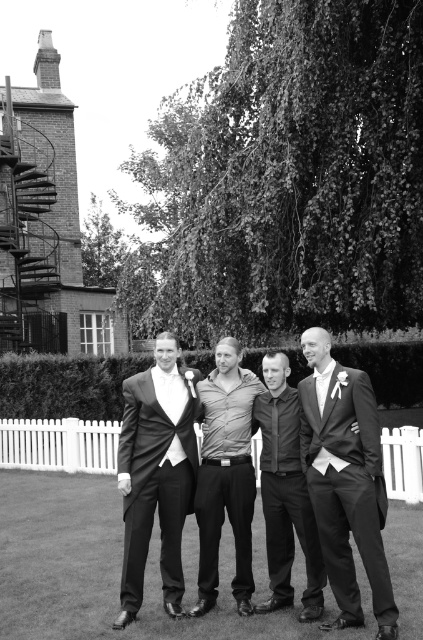
How distant is matte black suit at center from matte black suit at left?

A distance of 3.49 feet exists between matte black suit at center and matte black suit at left.

Does matte black suit at center appear on the right side of matte black suit at left?

Yes, matte black suit at center is to the right of matte black suit at left.

Where is `matte black suit at center`? Image resolution: width=423 pixels, height=640 pixels. matte black suit at center is located at coordinates (346, 493).

Locate an element on the screen. Image resolution: width=423 pixels, height=640 pixels. matte black suit at center is located at coordinates (346, 493).

Who is lower down, matte black suit at left or dark gray shirt at center?

dark gray shirt at center

Is matte black suit at left closer to the viewer compared to dark gray shirt at center?

Yes, it is in front of dark gray shirt at center.

Does point (183, 387) come in front of point (266, 604)?

No, it is behind (266, 604).

Find the location of a particular element. The height and width of the screenshot is (640, 423). matte black suit at left is located at coordinates (156, 474).

Which is above, matte black suit at center or shiny black suit at right?

shiny black suit at right is higher up.

How much distance is there between matte black suit at center and shiny black suit at right?

10.40 inches

Is point (320, 451) closer to viewer compared to point (359, 436)?

No, (320, 451) is behind (359, 436).

You are a GUI agent. You are given a task and a screenshot of the screen. Output one action in this format:
    pyautogui.click(x=<x>, y=<y>)
    Task: Click on the matte black suit at center
    This screenshot has height=640, width=423.
    Given the screenshot: What is the action you would take?
    pyautogui.click(x=346, y=493)